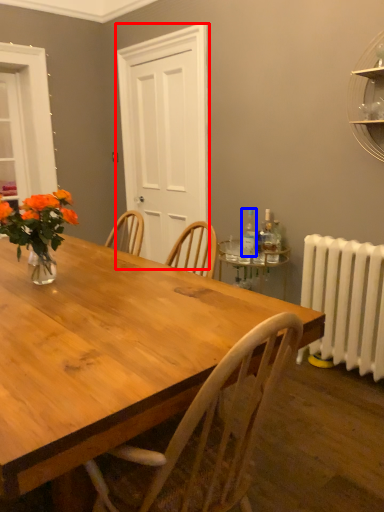
Question: Which point is further to the camera, glass door (highlighted by a red box) or bottle (highlighted by a blue box)?

Choices:
 (A) glass door
 (B) bottle

Answer: (A)